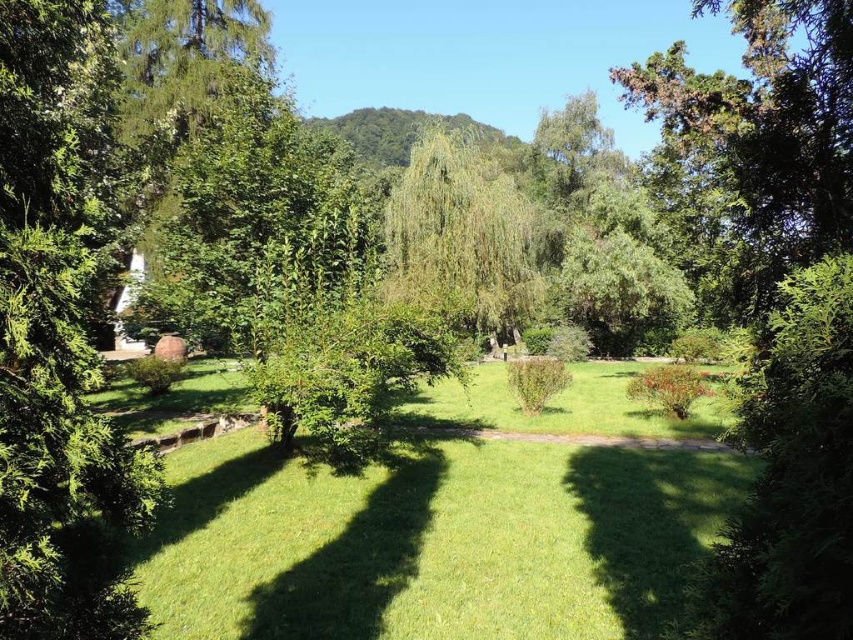
Question: Is green grass at center above green leafy tree at center?

Choices:
 (A) yes
 (B) no

Answer: (B)

Question: Does green grass at center appear on the left side of green leafy tree at center?

Choices:
 (A) yes
 (B) no

Answer: (B)

Question: Does green grass at center appear on the left side of green leafy tree at center?

Choices:
 (A) no
 (B) yes

Answer: (A)

Question: Which object is closer to the camera taking this photo?

Choices:
 (A) green leafy tree at center
 (B) green grass at center

Answer: (B)